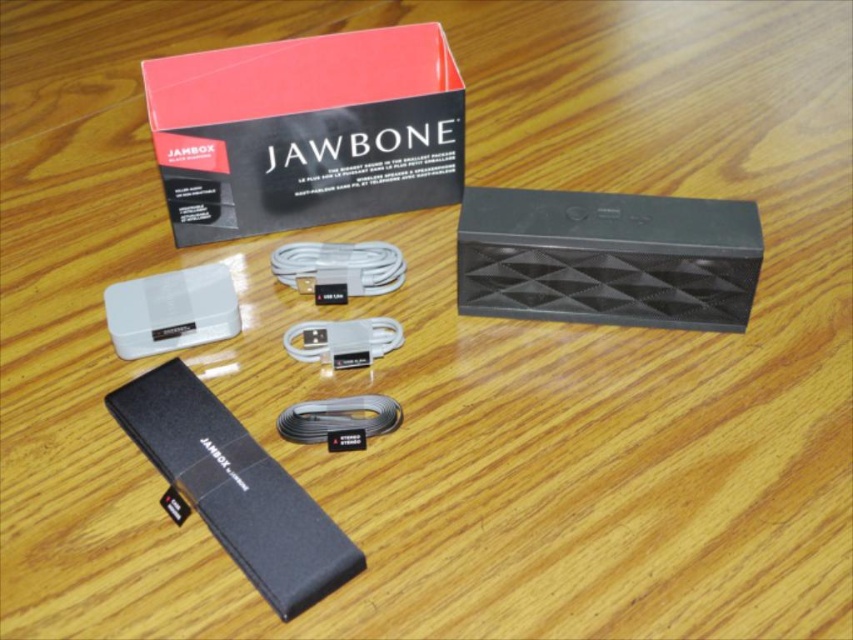
Can you confirm if matte black box at upper center is taller than black matte battery at lower left?

Correct, matte black box at upper center is much taller as black matte battery at lower left.

Does matte black box at upper center have a larger size compared to black matte battery at lower left?

Indeed, matte black box at upper center has a larger size compared to black matte battery at lower left.

This screenshot has width=853, height=640. Describe the element at coordinates (306, 131) in the screenshot. I see `matte black box at upper center` at that location.

Locate an element on the screen. This screenshot has height=640, width=853. matte black box at upper center is located at coordinates (306, 131).

Find the location of `black matte speaker at center`. black matte speaker at center is located at coordinates (607, 257).

In the scene shown: Can you confirm if black matte speaker at center is thinner than white matte usb cable at center?

No.

Is black matte speaker at center shorter than white matte usb cable at center?

No.

Who is more distant from viewer, (665, 234) or (350, 333)?

Positioned behind is point (350, 333).

Where is `black matte speaker at center`? Image resolution: width=853 pixels, height=640 pixels. black matte speaker at center is located at coordinates (607, 257).